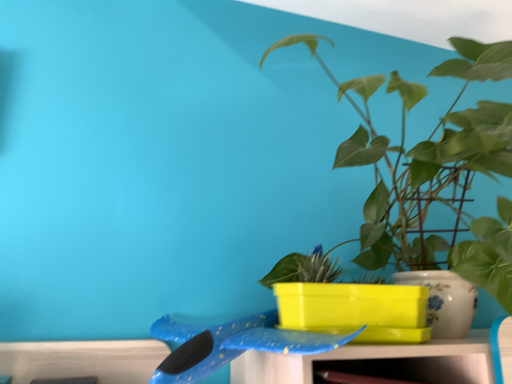
Question: In terms of height, does green glossy plant at upper right look taller or shorter compared to blue glossy whale at center?

Choices:
 (A) short
 (B) tall

Answer: (B)

Question: Does point (390, 92) appear closer or farther from the camera than point (311, 337)?

Choices:
 (A) closer
 (B) farther

Answer: (B)

Question: Would you say green glossy plant at upper right is to the left or to the right of blue glossy whale at center in the picture?

Choices:
 (A) left
 (B) right

Answer: (B)

Question: Is blue glossy whale at center taller or shorter than green glossy plant at upper right?

Choices:
 (A) short
 (B) tall

Answer: (A)

Question: Do you think blue glossy whale at center is within green glossy plant at upper right, or outside of it?

Choices:
 (A) outside
 (B) inside

Answer: (A)

Question: Is blue glossy whale at center in front of or behind green glossy plant at upper right in the image?

Choices:
 (A) front
 (B) behind

Answer: (B)

Question: From the image's perspective, relative to green glossy plant at upper right, is blue glossy whale at center above or below?

Choices:
 (A) below
 (B) above

Answer: (A)